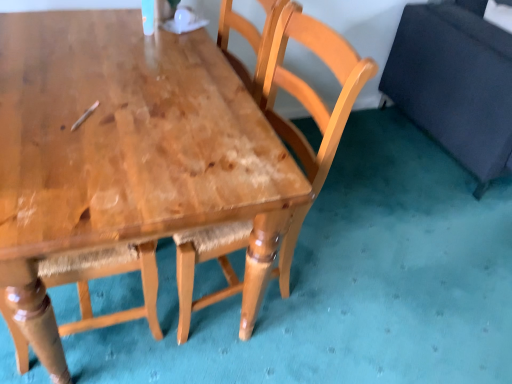
Question: Is wooden chair at center taller than shiny brown wood table at center?

Choices:
 (A) yes
 (B) no

Answer: (B)

Question: Would you consider wooden chair at center to be distant from shiny brown wood table at center?

Choices:
 (A) yes
 (B) no

Answer: (B)

Question: Is shiny brown wood table at center located within wooden chair at center?

Choices:
 (A) yes
 (B) no

Answer: (B)

Question: From a real-world perspective, is wooden chair at center physically above shiny brown wood table at center?

Choices:
 (A) yes
 (B) no

Answer: (A)

Question: Can you confirm if wooden chair at center is thinner than shiny brown wood table at center?

Choices:
 (A) no
 (B) yes

Answer: (A)

Question: Is wooden chair at center touching shiny brown wood table at center?

Choices:
 (A) yes
 (B) no

Answer: (B)

Question: Is dark blue fabric swivel chair at right beside wooden chair at center?

Choices:
 (A) yes
 (B) no

Answer: (B)

Question: Does dark blue fabric swivel chair at right come behind wooden chair at center?

Choices:
 (A) yes
 (B) no

Answer: (A)

Question: Is dark blue fabric swivel chair at right bigger than wooden chair at center?

Choices:
 (A) no
 (B) yes

Answer: (B)

Question: Considering the relative sizes of dark blue fabric swivel chair at right and wooden chair at center in the image provided, is dark blue fabric swivel chair at right thinner than wooden chair at center?

Choices:
 (A) no
 (B) yes

Answer: (A)

Question: From the image's perspective, is dark blue fabric swivel chair at right over wooden chair at center?

Choices:
 (A) yes
 (B) no

Answer: (A)

Question: From the image's perspective, is dark blue fabric swivel chair at right below wooden chair at center?

Choices:
 (A) no
 (B) yes

Answer: (A)

Question: Is shiny brown wood table at center not within dark blue fabric swivel chair at right?

Choices:
 (A) yes
 (B) no

Answer: (A)